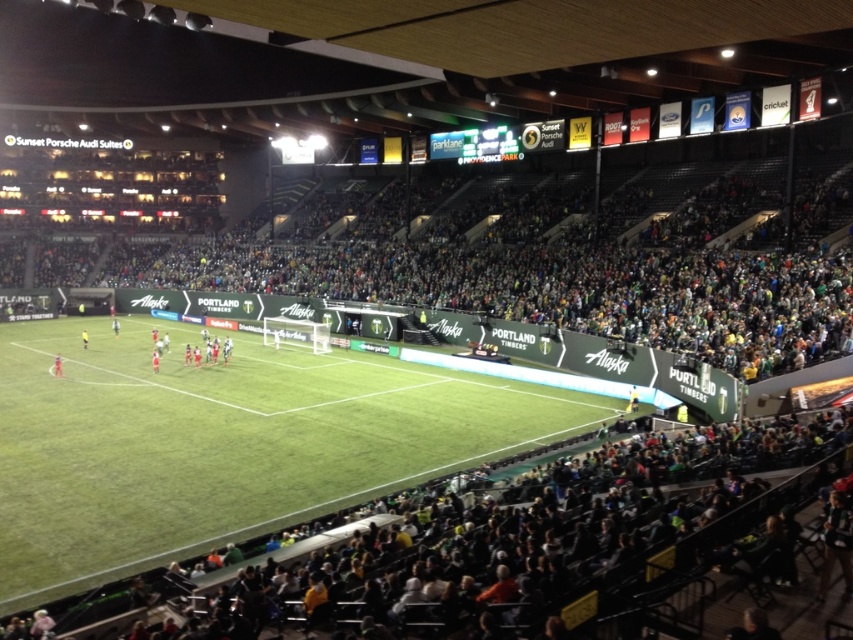
Question: Is green fabric crowd at center to the left of yellow fabric person at center from the viewer's perspective?

Choices:
 (A) yes
 (B) no

Answer: (B)

Question: Which point is closer to the camera taking this photo?

Choices:
 (A) (152, 352)
 (B) (54, 365)
 (C) (247, 518)
 (D) (704, 333)

Answer: (C)

Question: Which point is farther from the camera taking this photo?

Choices:
 (A) (68, 480)
 (B) (723, 273)

Answer: (B)

Question: Among these objects, which one is farthest from the camera?

Choices:
 (A) green jersey at center
 (B) green artificial turf at center
 (C) yellow fabric person at center

Answer: (C)

Question: Is green fabric crowd at center thinner than red fabric person at center?

Choices:
 (A) yes
 (B) no

Answer: (B)

Question: Observing the image, what is the correct spatial positioning of red fabric person at center in reference to green jersey at center?

Choices:
 (A) left
 (B) right

Answer: (A)